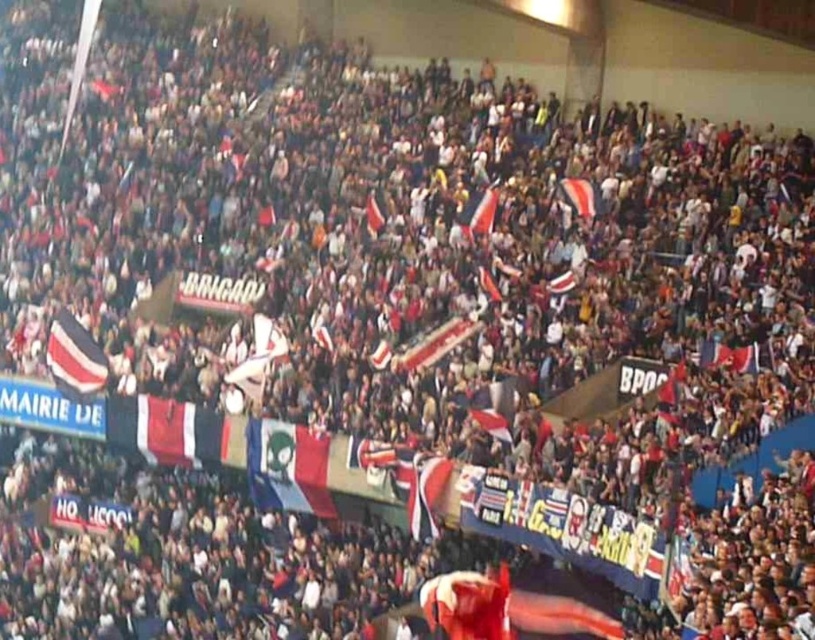
Is striped fabric flag at center further to the viewer compared to striped fabric flag at upper center?

Yes, striped fabric flag at center is behind striped fabric flag at upper center.

Between point (64, 340) and point (566, 196), which one is positioned in front?

Positioned in front is point (566, 196).

Does point (51, 349) come in front of point (589, 200)?

That is False.

Find the location of a particular element. striped fabric flag at center is located at coordinates (73, 356).

Measure the distance between tricolor fabric flag at center and white fabric flag at center.

A distance of 17.04 meters exists between tricolor fabric flag at center and white fabric flag at center.

Is tricolor fabric flag at center taller than white fabric flag at center?

In fact, tricolor fabric flag at center may be shorter than white fabric flag at center.

Which is in front, point (304, 465) or point (489, 211)?

Point (304, 465)

Identify the location of tricolor fabric flag at center. The width and height of the screenshot is (815, 640). (289, 467).

Is striped fabric flag at center positioned at the back of white fabric flag at center?

Yes.

Where is `striped fabric flag at center`? Image resolution: width=815 pixels, height=640 pixels. striped fabric flag at center is located at coordinates (73, 356).